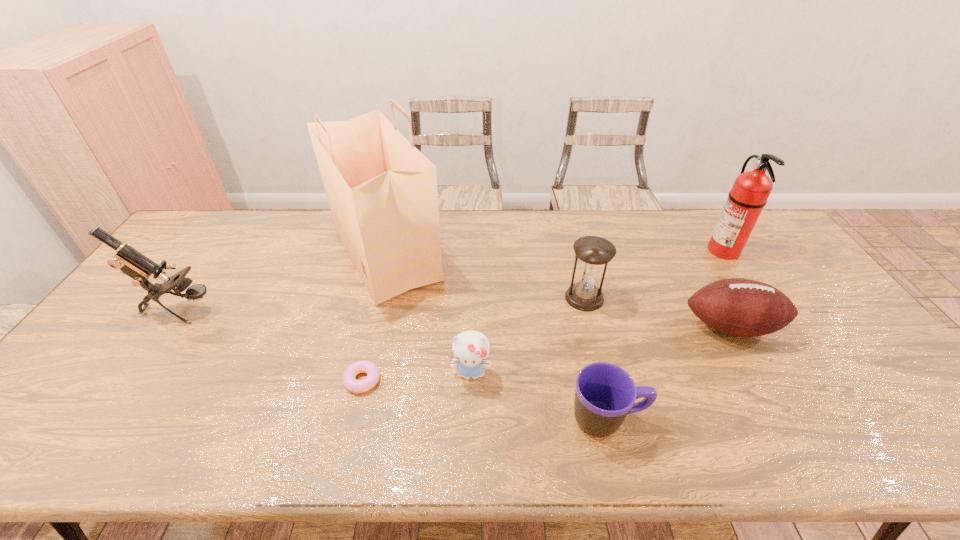
The height and width of the screenshot is (540, 960). Identify the location of fire extinguisher at the far edge. (750, 191).

Find the location of `object situated at the near edge`. object situated at the near edge is located at coordinates (x=605, y=394).

Locate an element on the screen. The width and height of the screenshot is (960, 540). object located at the left edge is located at coordinates (137, 266).

Find the location of a particular element. vacant space at the far edge is located at coordinates coord(631,221).

This screenshot has width=960, height=540. In order to click on vacant space at the near edge in this screenshot , I will do [x=638, y=429].

The image size is (960, 540). In order to click on vacant area at the left edge of the desktop in this screenshot , I will do `click(197, 266)`.

Image resolution: width=960 pixels, height=540 pixels. What are the coordinates of `vacant space at the far left corner` in the screenshot? It's located at (243, 212).

At what (x,y) coordinates should I click in order to perform the action: click on empty location between the football (American) and the hourglass. Please return your answer as a coordinate pair (x, y). This screenshot has width=960, height=540. Looking at the image, I should click on (658, 312).

This screenshot has height=540, width=960. I want to click on free spot between the leftmost object and the football (American), so click(456, 319).

The height and width of the screenshot is (540, 960). Identify the location of free space that is in between the football (American) and the tallest object. (559, 291).